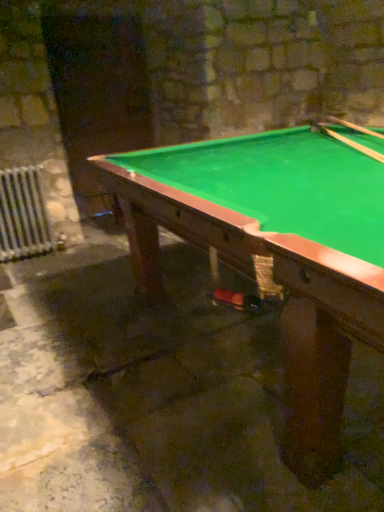
Question: Is wooden smooth cue at upper right, placed as the first cue when sorted from right to left, bigger or smaller than green felt pool table at center?

Choices:
 (A) big
 (B) small

Answer: (B)

Question: From their relative heights in the image, would you say wooden smooth cue at upper right, the 2th cue viewed from the left, is taller or shorter than green felt pool table at center?

Choices:
 (A) tall
 (B) short

Answer: (B)

Question: Estimate the real-world distances between objects in this image. Which object is farther from the wooden smooth cue at upper right, the 2th cue viewed from the left?

Choices:
 (A) green felt pool table at center
 (B) white metal radiator at lower left
 (C) wooden cue at upper right, arranged as the 1th cue when viewed from the left

Answer: (B)

Question: Which of these objects is positioned closest to the green felt pool table at center?

Choices:
 (A) wooden smooth cue at upper right, the 2th cue viewed from the left
 (B) white metal radiator at lower left
 (C) wooden cue at upper right, the 2th cue when ordered from right to left

Answer: (C)